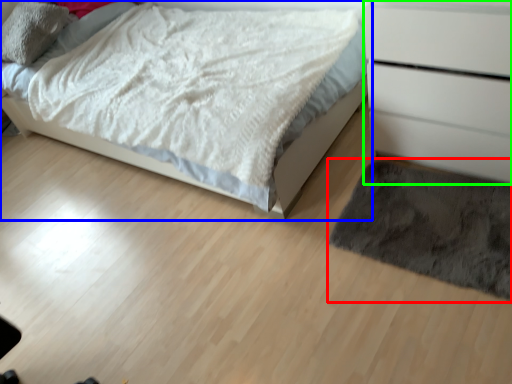
Question: Which object is the closest to the mat (highlighted by a red box)? Choose among these: bed (highlighted by a blue box) or chest of drawers (highlighted by a green box).

Choices:
 (A) bed
 (B) chest of drawers

Answer: (B)